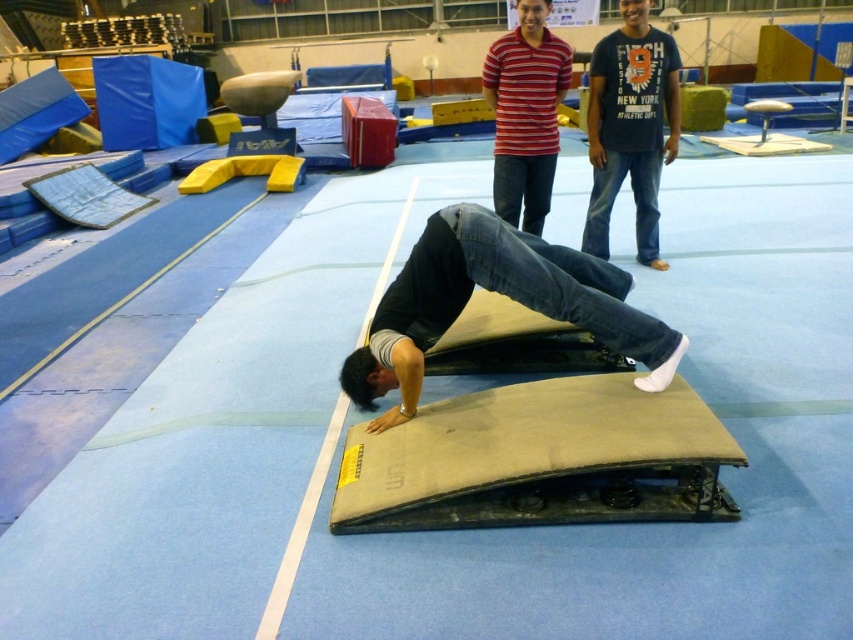
Looking at this image, which is above, dark blue t-shirt at upper right or striped cotton shirt at upper center?

Positioned higher is striped cotton shirt at upper center.

From the picture: Who is positioned more to the right, dark blue t-shirt at upper right or striped cotton shirt at upper center?

From the viewer's perspective, dark blue t-shirt at upper right appears more on the right side.

Identify the location of dark blue t-shirt at upper right. This screenshot has width=853, height=640. (x=630, y=125).

Is denim jeans at center shorter than dark blue t-shirt at upper right?

Correct, denim jeans at center is not as tall as dark blue t-shirt at upper right.

Can you confirm if denim jeans at center is positioned to the right of dark blue t-shirt at upper right?

Incorrect, denim jeans at center is not on the right side of dark blue t-shirt at upper right.

Is point (582, 269) positioned behind point (595, 67)?

No, (582, 269) is closer to viewer.

This screenshot has width=853, height=640. In order to click on denim jeans at center in this screenshot , I will do `click(498, 292)`.

Which is behind, point (490, 284) or point (521, 88)?

Positioned behind is point (521, 88).

How distant is denim jeans at center from striped cotton shirt at upper center?

The distance of denim jeans at center from striped cotton shirt at upper center is 5.11 feet.

Is point (476, 205) in front of point (511, 56)?

Yes, it is in front of point (511, 56).

The width and height of the screenshot is (853, 640). In order to click on denim jeans at center in this screenshot , I will do `click(498, 292)`.